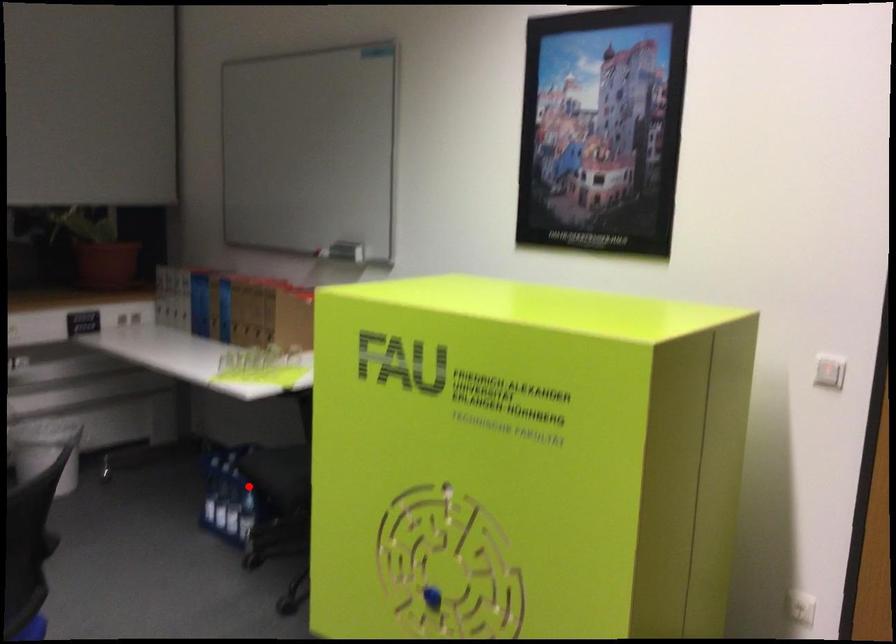
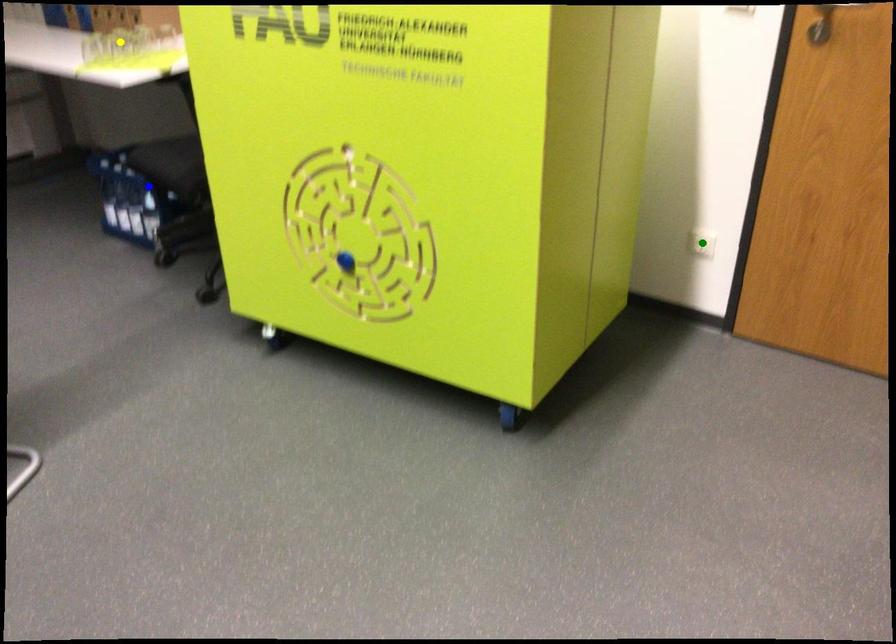
Question: I am providing you with two images of the same scene from different viewpoints. A red point is marked on the first image. You are given multiple points on the second image. Which spot in image 2 lines up with the point in image 1?

Choices:
 (A) green point
 (B) blue point
 (C) yellow point

Answer: (B)